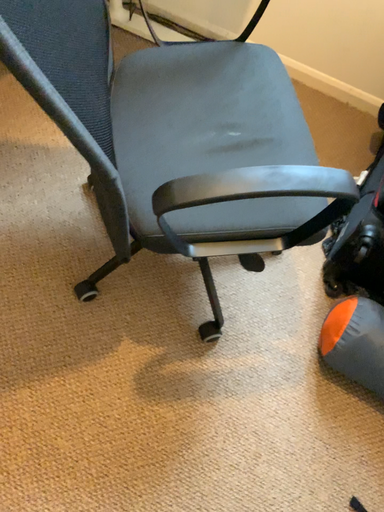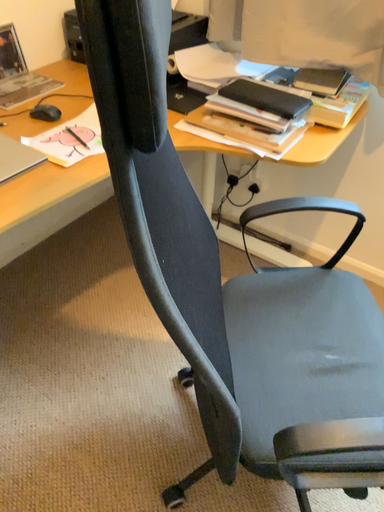
Question: How did the camera likely rotate when shooting the video?

Choices:
 (A) rotated left
 (B) rotated right

Answer: (A)